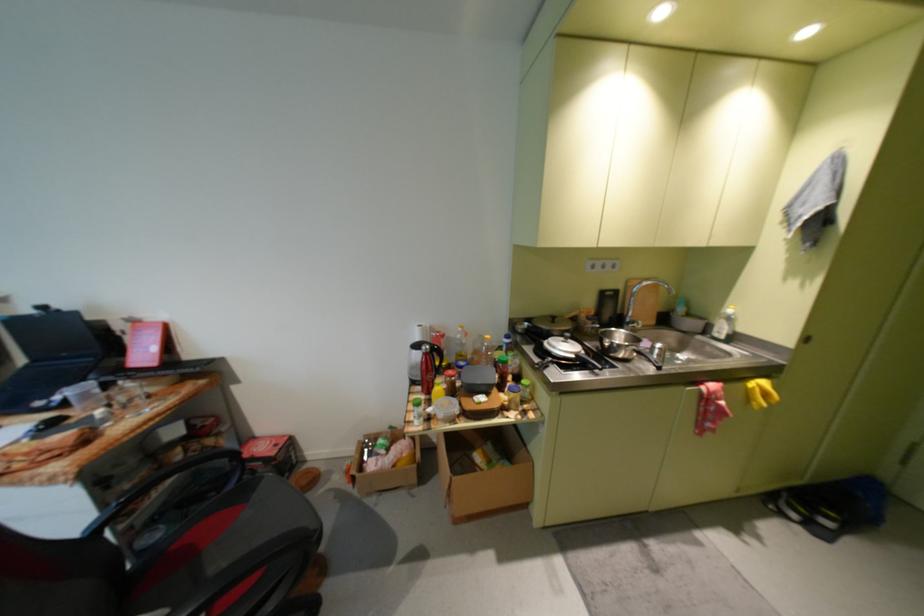
Where would you lift the red pizza box? Please return your answer as a coordinate pair (x, y).

(271, 454)